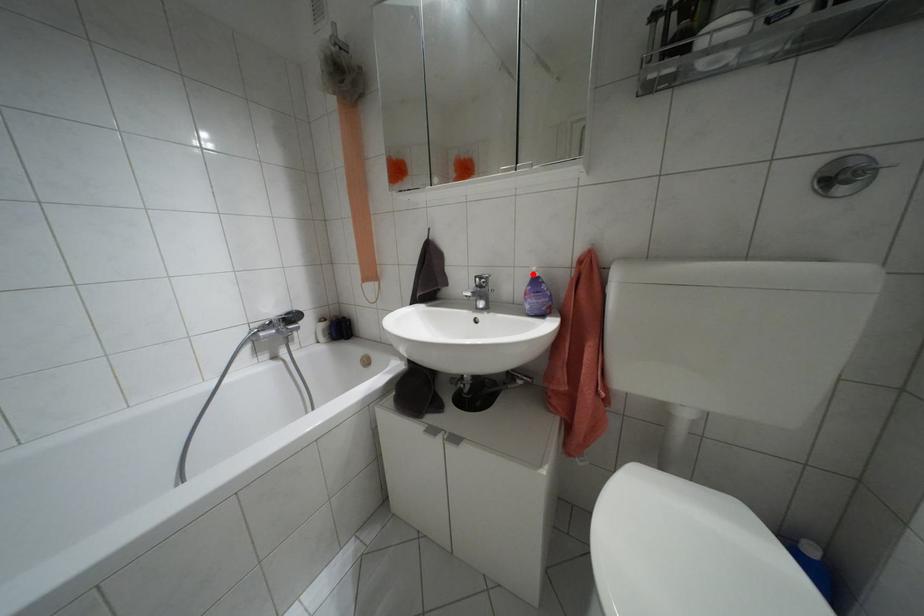
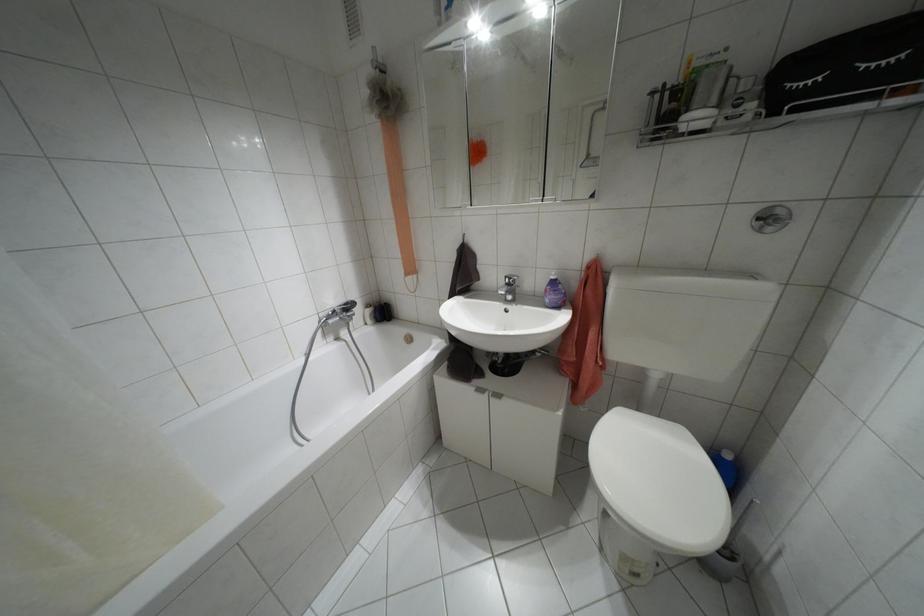
In the second image, find the point that corresponds to the highlighted location in the first image.

(552, 277)